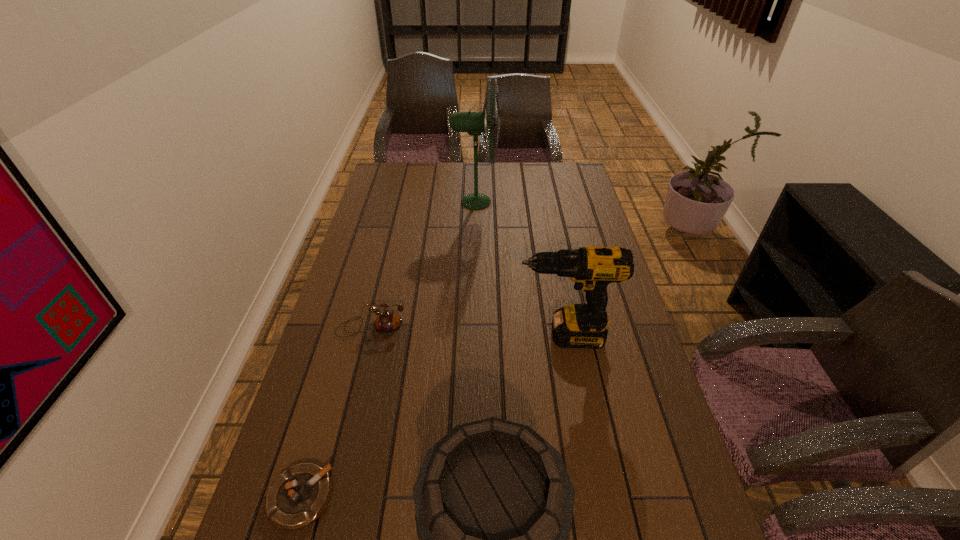
Locate an element on the screen. The height and width of the screenshot is (540, 960). free spot located 0.240m on the back of the ashtray is located at coordinates (336, 376).

At what (x,y) coordinates should I click in order to perform the action: click on object at the far edge. Please return your answer as a coordinate pair (x, y). Image resolution: width=960 pixels, height=540 pixels. Looking at the image, I should click on 474,123.

Identify the location of telephone located at the left edge. tap(387, 321).

Identify the location of ashtray that is positioned at the left edge. The image size is (960, 540). (298, 496).

This screenshot has width=960, height=540. What are the coordinates of `object that is at the right edge` in the screenshot? It's located at (592, 268).

This screenshot has height=540, width=960. In the image, there is a desktop. Identify the location of free region at the far edge. (540, 165).

Image resolution: width=960 pixels, height=540 pixels. In order to click on vacant space at the left edge in this screenshot , I will do `click(391, 273)`.

In the image, there is a desktop. In order to click on vacant space at the right edge in this screenshot , I will do `click(564, 218)`.

Where is `free point at the far left corner`? free point at the far left corner is located at coordinates (380, 172).

Image resolution: width=960 pixels, height=540 pixels. I want to click on free space that is in between the tallest object and the telephone, so click(x=423, y=265).